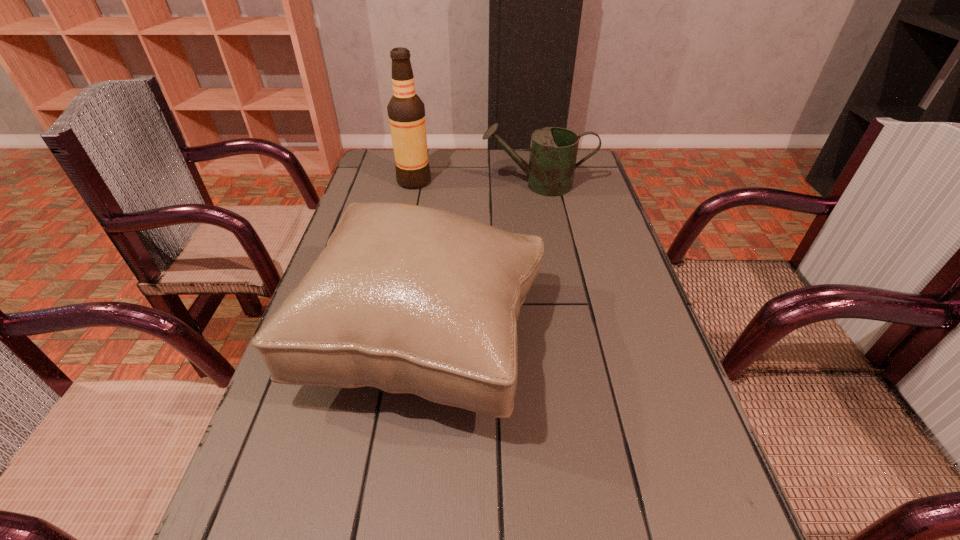
The image size is (960, 540). What are the coordinates of `watering can situated at the far edge` in the screenshot? It's located at (553, 152).

What are the coordinates of `alcohol present at the left edge` in the screenshot? It's located at (406, 112).

The image size is (960, 540). I want to click on cushion that is at the left edge, so click(x=408, y=299).

You are a GUI agent. You are given a task and a screenshot of the screen. Output one action in this format:
    pyautogui.click(x=<x>, y=<y>)
    Task: Click on the object that is at the right edge
    
    Given the screenshot: What is the action you would take?
    pyautogui.click(x=553, y=152)

I want to click on object at the far left corner, so click(x=406, y=112).

Where is `object that is at the far right corner`? object that is at the far right corner is located at coordinates (553, 152).

In the image, there is a desktop. Find the location of `vacant space at the far edge`. vacant space at the far edge is located at coordinates (474, 160).

You are a GUI agent. You are given a task and a screenshot of the screen. Output one action in this format:
    pyautogui.click(x=<x>, y=<y>)
    Task: Click on the vacant region at the left edge of the desktop
    
    Given the screenshot: What is the action you would take?
    pyautogui.click(x=327, y=422)

Identify the location of free region at the right edge of the desktop. The height and width of the screenshot is (540, 960). (656, 462).

Identify the location of free spot between the watering can and the tallest object. (476, 183).